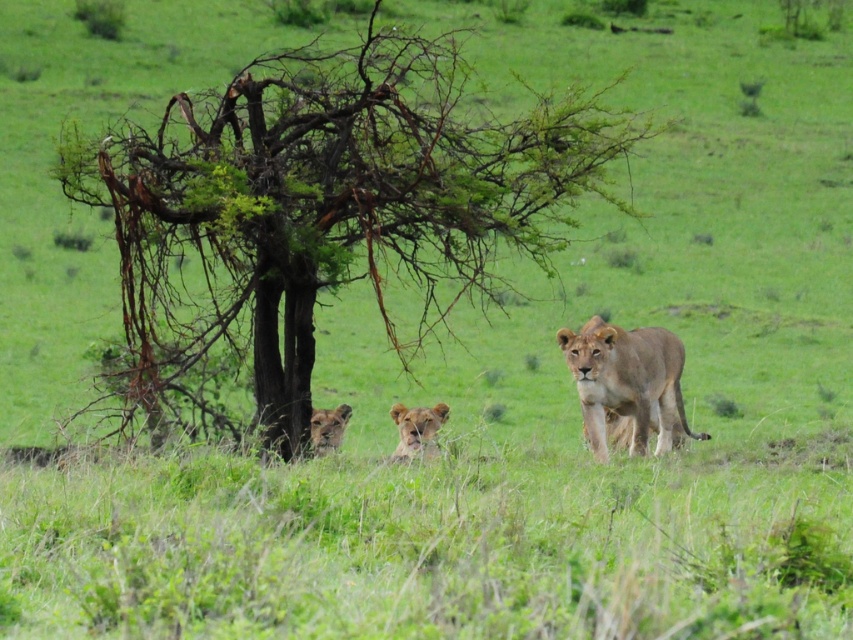
You are a wildlife photographer aiming to capture a photo of the golden fur lion at center and the golden fur lion at lower center in the savanna scene. If your camera can focus on subjects within a 20 inch range, will both lions be in focus at the same time?

The golden fur lion at center and golden fur lion at lower center are 23.37 inches apart from each other. Since the distance between them exceeds the camera focus range of 20 inches, both lions cannot be in focus simultaneously.

You are a safari guide leading a tour. You notice the green leafy tree at center and the golden fur lion at center in the image. Which object is closer to the front of the scene?

The green leafy tree at center is in front of the golden fur lion at center, so the green leafy tree at center is closer to the front of the scene.